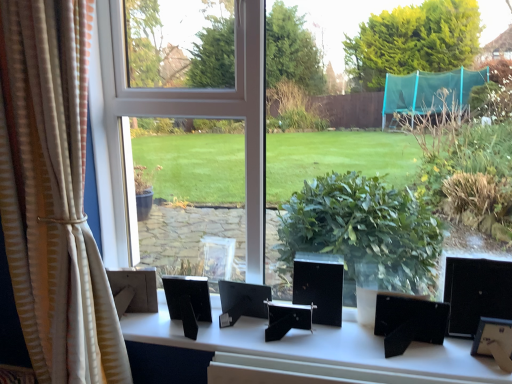
What do you see at coordinates (53, 196) in the screenshot?
I see `beige striped curtain at left` at bounding box center [53, 196].

Locate an element on the screen. transparent glass window at center is located at coordinates click(x=211, y=136).

Which is in front, black plastic picture frames at center or beige striped curtain at left?

beige striped curtain at left is in front.

Between black plastic picture frames at center and beige striped curtain at left, which one has larger size?

With larger size is beige striped curtain at left.

Is black plastic picture frames at center in contact with beige striped curtain at left?

black plastic picture frames at center is not next to beige striped curtain at left, and they're not touching.

What's the angular difference between black plastic picture frames at center and beige striped curtain at left's facing directions?

The angle between the facing direction of black plastic picture frames at center and the facing direction of beige striped curtain at left is 0.608 degrees.

From a real-world perspective, is black plastic picture frames at center above or below transparent glass window at center?

Clearly, from a real-world perspective, black plastic picture frames at center is below transparent glass window at center.

At what (x,y) coordinates should I click in order to perform the action: click on table below the transparent glass window at center (from the image's perspective). Please return your answer as a coordinate pair (x, y). This screenshot has width=512, height=384. Looking at the image, I should click on (315, 345).

Considering the positions of objects black plastic picture frames at center and transparent glass window at center in the image provided, who is more to the left, black plastic picture frames at center or transparent glass window at center?

Positioned to the left is transparent glass window at center.

Can you see black plastic picture frames at center touching transparent glass window at center?

No.

In terms of width, does beige striped curtain at left look wider or thinner when compared to transparent glass window at center?

beige striped curtain at left is thinner than transparent glass window at center.

Considering the points (29, 76) and (166, 188), which point is behind, point (29, 76) or point (166, 188)?

The point (166, 188) is behind.

Is beige striped curtain at left completely or partially outside of transparent glass window at center?

Yes, beige striped curtain at left is not within transparent glass window at center.

Based on their sizes in the image, would you say beige striped curtain at left is bigger or smaller than transparent glass window at center?

In the image, beige striped curtain at left appears to be smaller than transparent glass window at center.

Who is more distant, beige striped curtain at left or black plastic picture frames at center?

black plastic picture frames at center is further from the camera.

Who is smaller, beige striped curtain at left or black plastic picture frames at center?

black plastic picture frames at center is smaller.

Which is more to the left, beige striped curtain at left or black plastic picture frames at center?

From the viewer's perspective, beige striped curtain at left appears more on the left side.

From the image's perspective, is transparent glass window at center above or below beige striped curtain at left?

transparent glass window at center is situated higher than beige striped curtain at left in the image.

Based on the photo, is transparent glass window at center bigger or smaller than beige striped curtain at left?

Clearly, transparent glass window at center is larger in size than beige striped curtain at left.

Between point (218, 185) and point (79, 62), which one is positioned behind?

Point (218, 185)

Between transparent glass window at center and beige striped curtain at left, which one has larger width?

transparent glass window at center is wider.

From a real-world perspective, is transparent glass window at center above or below black plastic picture frames at center?

In terms of real-world spatial position, transparent glass window at center is above black plastic picture frames at center.

Is transparent glass window at center beside black plastic picture frames at center?

transparent glass window at center and black plastic picture frames at center are not in contact.

How different are the orientations of transparent glass window at center and black plastic picture frames at center in degrees?

The angle between the facing direction of transparent glass window at center and the facing direction of black plastic picture frames at center is 0.533 degrees.

Between transparent glass window at center and black plastic picture frames at center, which one has larger width?

black plastic picture frames at center.

Where is `table on the right side of beige striped curtain at left`? The width and height of the screenshot is (512, 384). table on the right side of beige striped curtain at left is located at coordinates click(315, 345).

Where is `window that is in front of the black plastic picture frames at center`? window that is in front of the black plastic picture frames at center is located at coordinates (211, 136).

Looking at the image, which one is located closer to black plastic picture frames at center, transparent glass window at center or beige striped curtain at left?

Based on the image, beige striped curtain at left appears to be nearer to black plastic picture frames at center.

When comparing their distances from black plastic picture frames at center, does beige striped curtain at left or transparent glass window at center seem further?

transparent glass window at center.

Considering their positions, is black plastic picture frames at center positioned further to beige striped curtain at left than transparent glass window at center?

transparent glass window at center lies further to beige striped curtain at left than the other object.

Looking at the image, which one is located further to transparent glass window at center, beige striped curtain at left or black plastic picture frames at center?

black plastic picture frames at center is further to transparent glass window at center.

Estimate the real-world distances between objects in this image. Which object is closer to beige striped curtain at left, transparent glass window at center or black plastic picture frames at center?

black plastic picture frames at center lies closer to beige striped curtain at left than the other object.

From the image, which object appears to be farther from transparent glass window at center, black plastic picture frames at center or beige striped curtain at left?

Based on the image, black plastic picture frames at center appears to be further to transparent glass window at center.

In order to click on window between beige striped curtain at left and black plastic picture frames at center from left to right in this screenshot , I will do `click(211, 136)`.